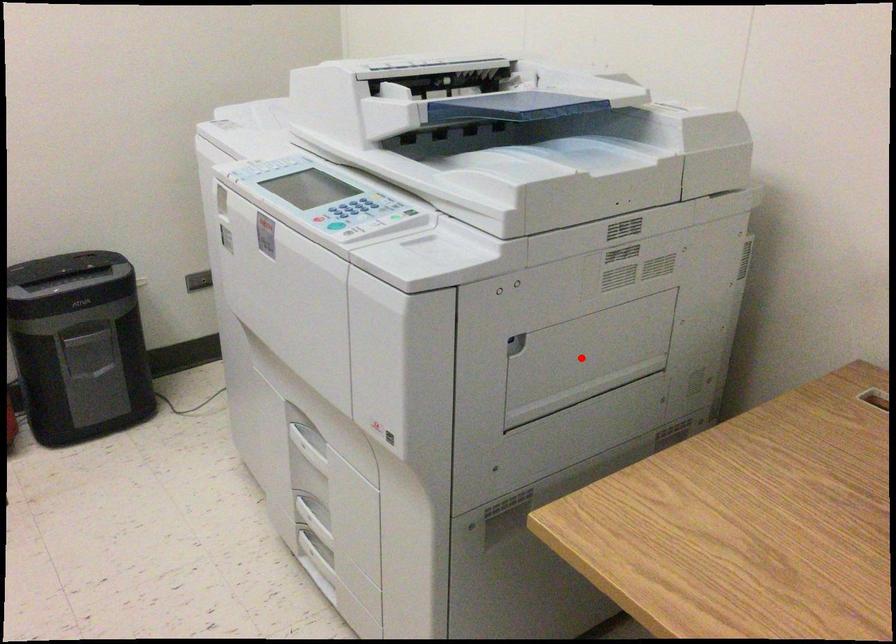
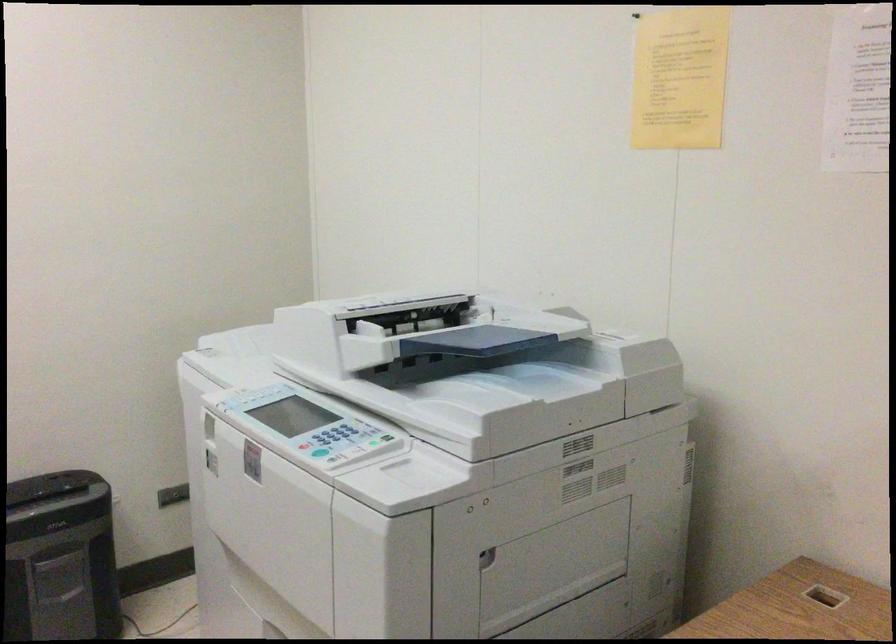
Locate, in the second image, the point that corresponds to the highlighted location in the first image.

(552, 567)